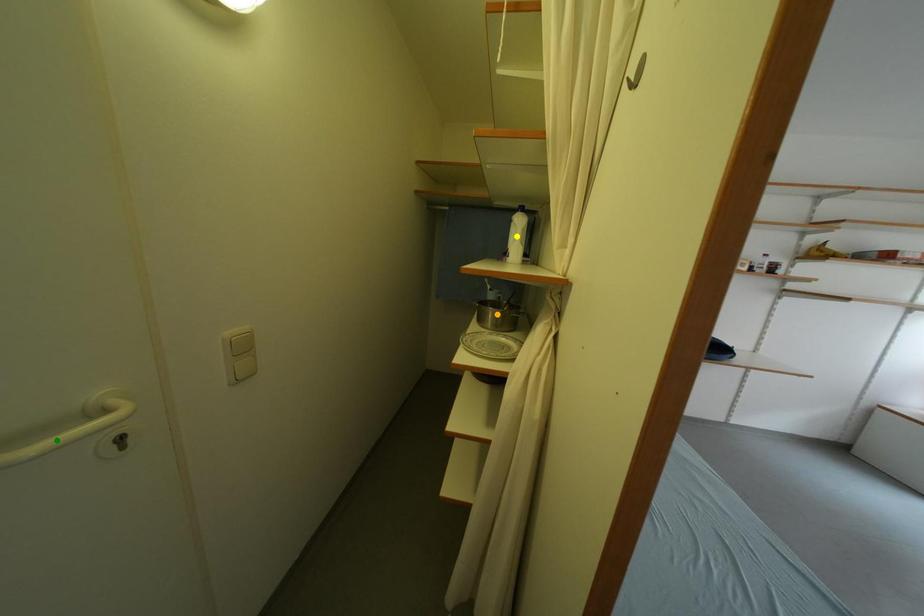
Order these from nearest to farthest:
1. orange point
2. green point
3. yellow point

yellow point
orange point
green point